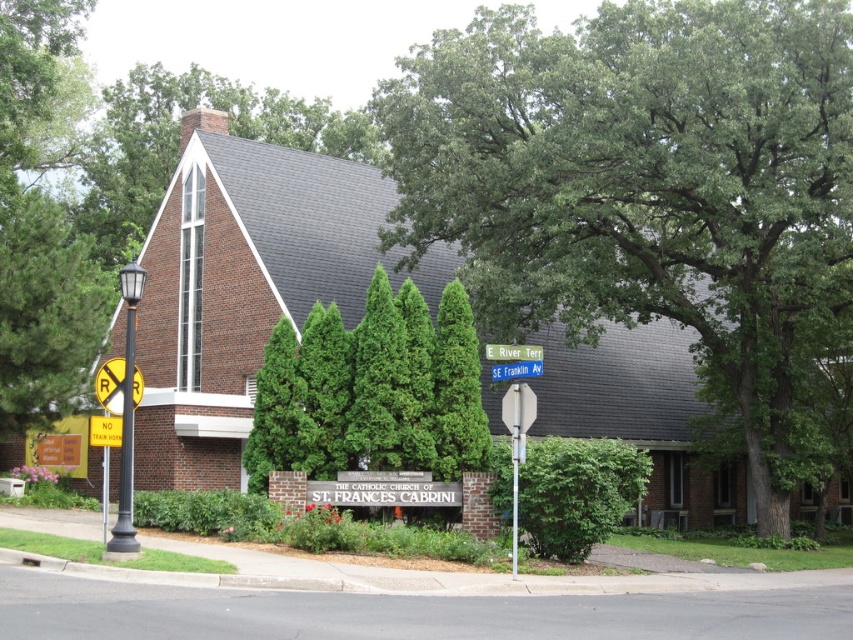
Question: Which point is farther to the camera?

Choices:
 (A) green leafy bush at center
 (B) green leafy tree at left

Answer: (B)

Question: Can you confirm if green leafy bush at center is positioned to the left of yellowmaterial/texturesign at upper center?

Choices:
 (A) no
 (B) yes

Answer: (A)

Question: Estimate the real-world distances between objects in this image. Which object is farther from the green leafy tree at left?

Choices:
 (A) yellow plastic sign at left
 (B) green leafy tree at center
 (C) yellow plastic sign at center

Answer: (C)

Question: Which object is farther from the camera taking this photo?

Choices:
 (A) green leafy tree at center
 (B) yellowmaterial/texturesign at upper center

Answer: (A)

Question: Is green leafy tree at left smaller than green leafy bush at center?

Choices:
 (A) no
 (B) yes

Answer: (A)

Question: Is black metal pole at center bigger than yellow plastic sign at center?

Choices:
 (A) yes
 (B) no

Answer: (A)